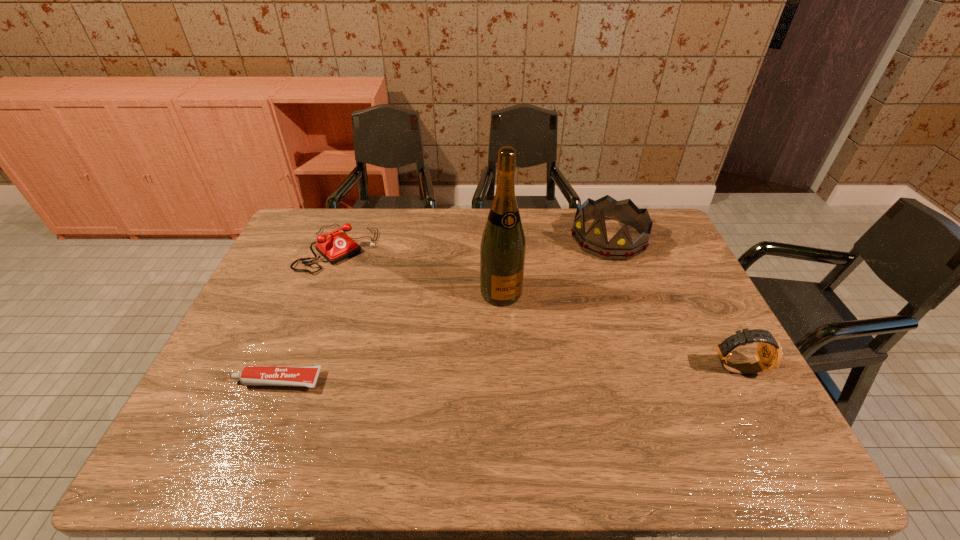
At what (x,y) coordinates should I click in order to perform the action: click on toothpaste at the left edge. Please return your answer as a coordinate pair (x, y). The image size is (960, 540). Looking at the image, I should click on (303, 376).

The width and height of the screenshot is (960, 540). In order to click on telephone that is at the left edge in this screenshot , I will do `click(338, 246)`.

This screenshot has height=540, width=960. Identify the location of watch present at the right edge. (769, 354).

The image size is (960, 540). What are the coordinates of `tiara that is at the right edge` in the screenshot? It's located at (595, 241).

I want to click on object located in the far left corner section of the desktop, so click(338, 246).

The width and height of the screenshot is (960, 540). What are the coordinates of `object that is positioned at the near left corner` in the screenshot? It's located at (303, 376).

Where is `object that is positioned at the far right corner`? This screenshot has height=540, width=960. object that is positioned at the far right corner is located at coordinates (595, 241).

Image resolution: width=960 pixels, height=540 pixels. I want to click on free point at the far edge, so click(x=541, y=220).

Identify the location of vacant position at the near edge of the desktop. The image size is (960, 540). (365, 423).

Identify the location of free space at the left edge. The width and height of the screenshot is (960, 540). (283, 259).